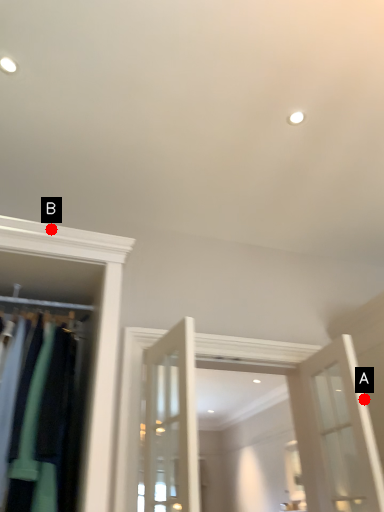
Question: Two points are circled on the image, labeled by A and B beside each circle. Which of the following is the closest to the observer?

Choices:
 (A) A is closer
 (B) B is closer

Answer: (B)